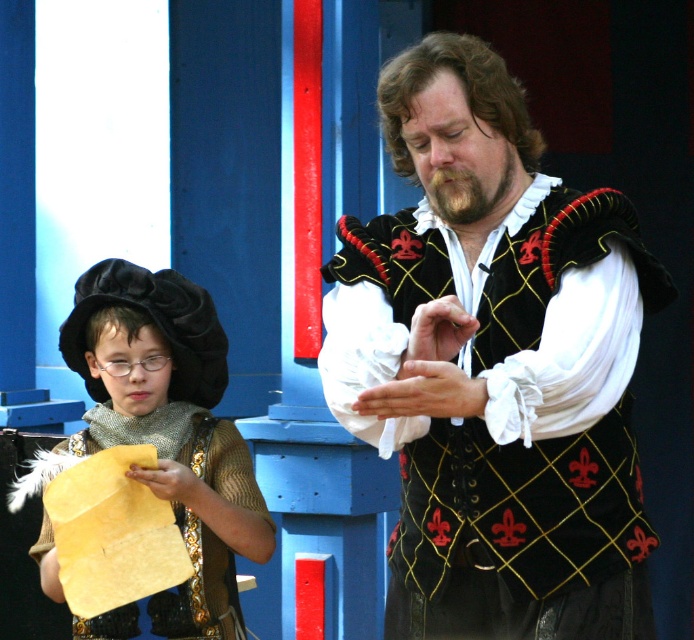
You are an actor in a play and need to place a small prop at point (496, 365). Based on the scene description, where exactly should you place the prop?

The prop should be placed on the black velvet vest at center, as point 0.575, 0.715 is located there.

You are an assistant helping to prepare for a costume fitting. You have two items to place on a rack. The black velvet vest at center and the matte gold paper at left. The rack has a height limit of 30 cm. Which item is more likely to exceed the rack height limit?

The black velvet vest at center has a greater height compared to the matte gold paper at left, so it is more likely to exceed the rack height limit of 30 cm.

You are a photographer standing in front of the two performers. You want to take a photo where the person on the left is in focus while keeping the person on the right slightly blurred. Which of the two points, point (389, 90) or point (167, 355), should you focus on to achieve this?

You should focus on point (389, 90) because it is closer to the camera than point (167, 355). Focusing on the closer point will keep the person on the left in focus and blur the background, including the person on the right.